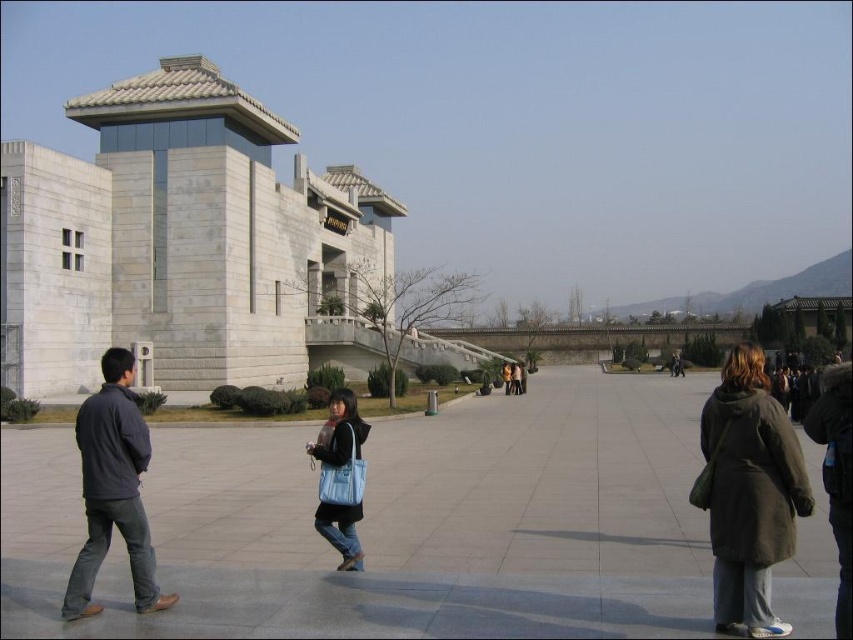
You are standing at the entrance of the building and want to pick up the dark gray fur coat at lower right. Which direction should you walk to reach it?

The dark gray fur coat at lower right is located at point (750, 492), so you should walk towards the lower right direction from the entrance to reach it.

You are standing on the plaza in front of the white stone building at left and the matte blue bag at center. If you look up from the bag, will you see the building?

Yes, because the white stone building at left is located above the matte blue bag at center, so looking up from the bag would allow you to see the building.